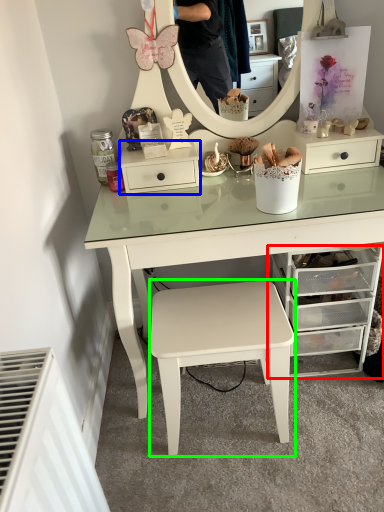
Question: Which object is the closest to the chest of drawers (highlighted by a red box)? Choose among these: nightstand (highlighted by a blue box) or stool (highlighted by a green box).

Choices:
 (A) nightstand
 (B) stool

Answer: (B)